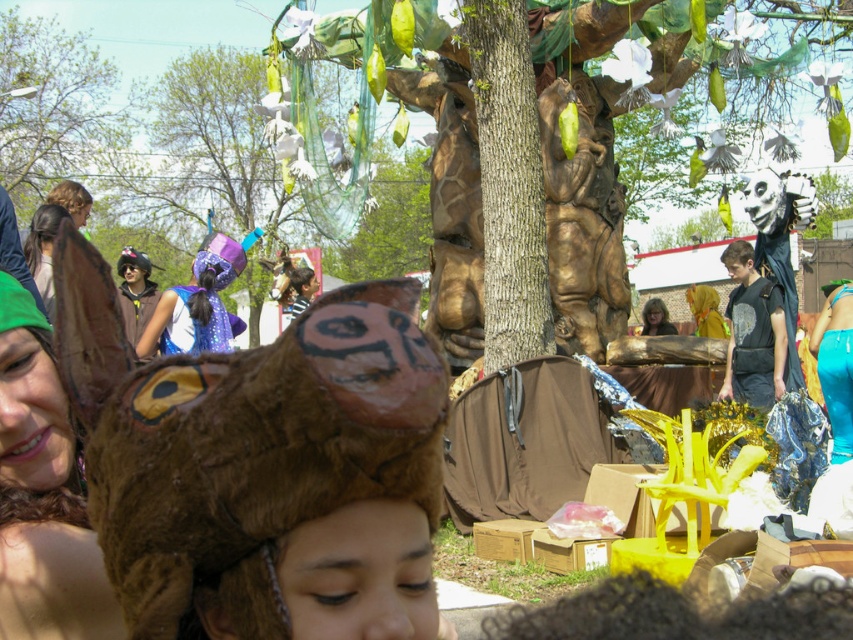
Is the position of green matte tree at upper center less distant than that of matte brown hair at center?

No, green matte tree at upper center is further to the viewer.

You are a GUI agent. You are given a task and a screenshot of the screen. Output one action in this format:
    pyautogui.click(x=<x>, y=<y>)
    Task: Click on the green matte tree at upper center
    
    Given the screenshot: What is the action you would take?
    tap(209, 152)

Is point (35, 618) behind point (811, 349)?

No.

The image size is (853, 640). In order to click on green fabric headband at upper left in this screenshot , I will do `click(42, 493)`.

Which is above, green fabric headband at upper left or sparkly purple cape at center?

sparkly purple cape at center

In the scene shown: Which of these two, green fabric headband at upper left or sparkly purple cape at center, stands shorter?

With less height is sparkly purple cape at center.

Between point (18, 548) and point (173, 340), which one is positioned in front?

Point (18, 548) is in front.

Where is `green fabric headband at upper left`? green fabric headband at upper left is located at coordinates (42, 493).